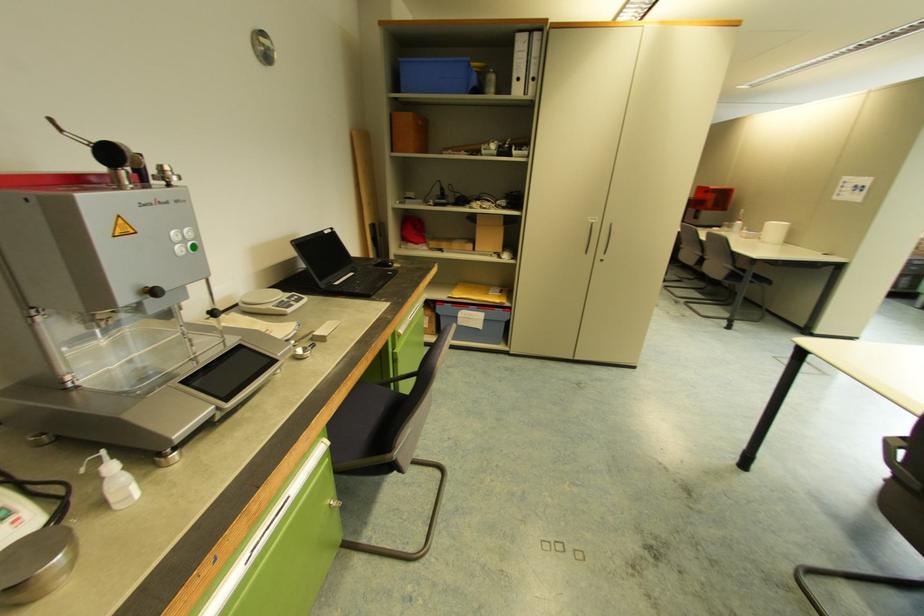
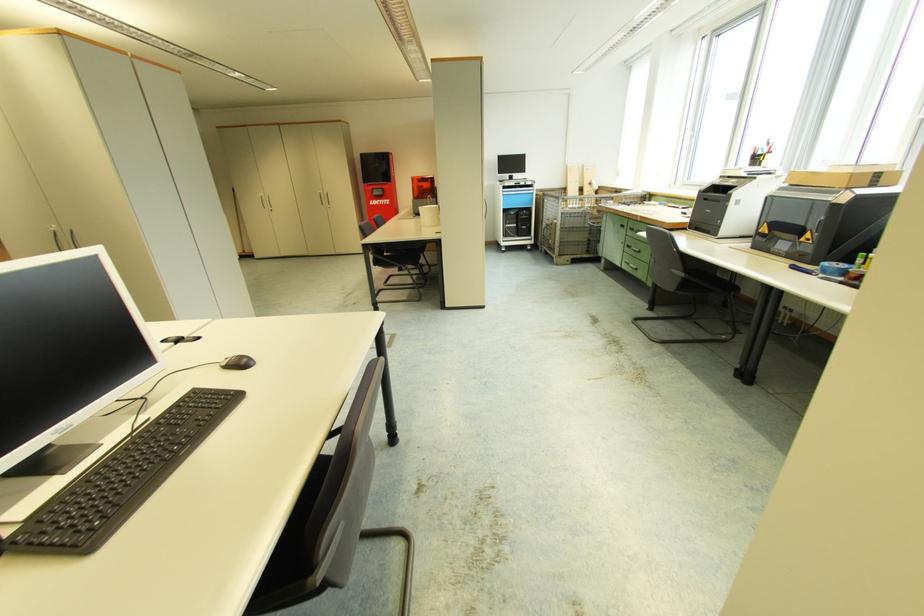
Question: In a continuous first-person perspective shot, in which direction is the camera moving?

Choices:
 (A) Left
 (B) Right
 (C) Forward
 (D) Backward

Answer: (B)